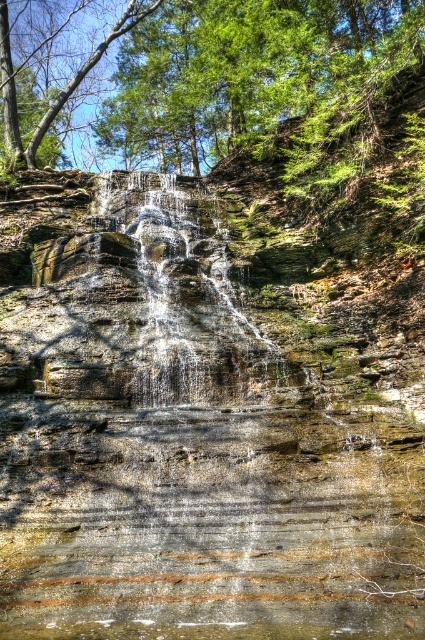
Is green leafy tree at upper center to the left of translucent water at center from the viewer's perspective?

Indeed, green leafy tree at upper center is positioned on the left side of translucent water at center.

Measure the distance between point (404, 45) and camera.

They are 75.69 feet apart.

Measure the distance between point [192,40] and camera.

The distance of point [192,40] from camera is 122.47 feet.

Locate an element on the screen. The height and width of the screenshot is (640, 425). green leafy tree at upper center is located at coordinates (249, 72).

Is point (337, 490) less distant than point (181, 218)?

Yes, point (337, 490) is in front of point (181, 218).

Is clear water at center above translucent water at center?

Incorrect, clear water at center is not positioned above translucent water at center.

The image size is (425, 640). Find the location of `clear water at center`. clear water at center is located at coordinates (207, 412).

At what (x,y) coordinates should I click in order to perform the action: click on clear water at center. Please return your answer as a coordinate pair (x, y). This screenshot has height=640, width=425. Looking at the image, I should click on (207, 412).

Between point (116, 301) and point (240, 33), which one is positioned in front?

Point (116, 301)

Who is more forward, (158,524) or (195,122)?

Positioned in front is point (158,524).

This screenshot has width=425, height=640. Find the location of `clear water at center`. clear water at center is located at coordinates (207, 412).